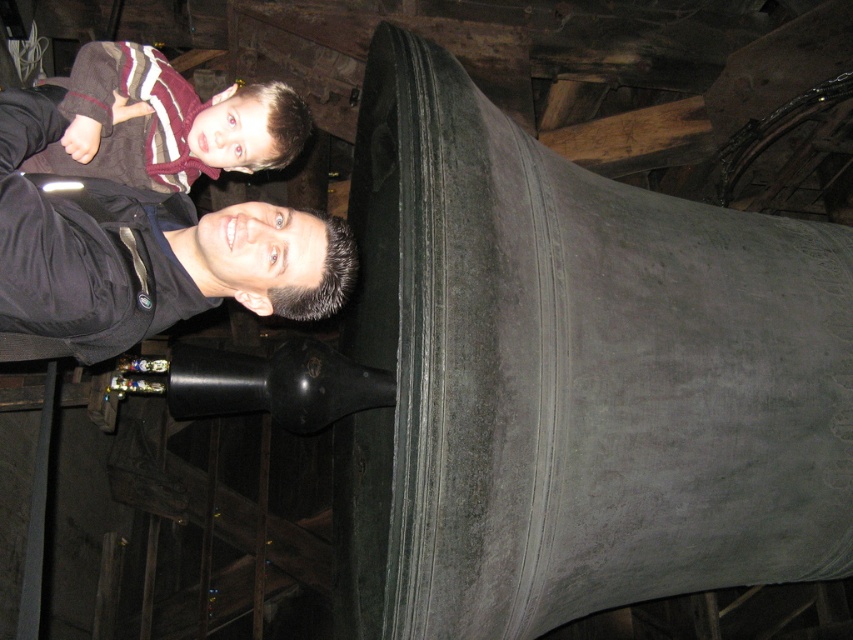
You are standing in a bell tower and see the matte black jacket at lower left. If you want to pick it up, where should you move to in the scene?

You should move to the lower left area of the scene, specifically to the coordinates point at (143, 250), where the matte black jacket at lower left is located.

You are an architect examining the bell tower structure. You notice two points marked on the bell surface at coordinates point (44,180) and point (79,80). Which point is positioned closer to your viewpoint?

Point (44,180) is closer to the viewer than point (79,80).